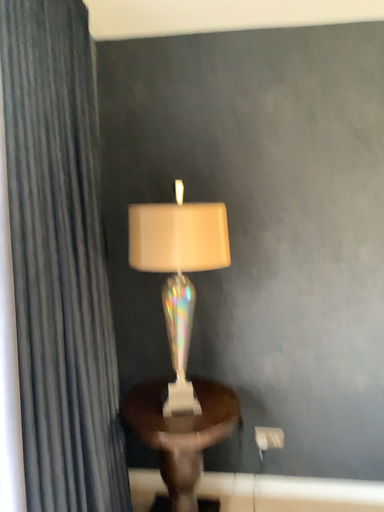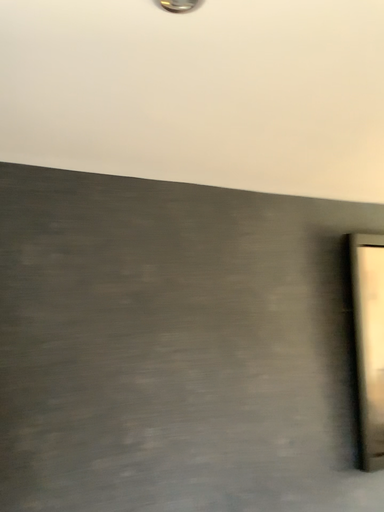
Question: How did the camera likely rotate when shooting the video?

Choices:
 (A) rotated right
 (B) rotated left

Answer: (A)